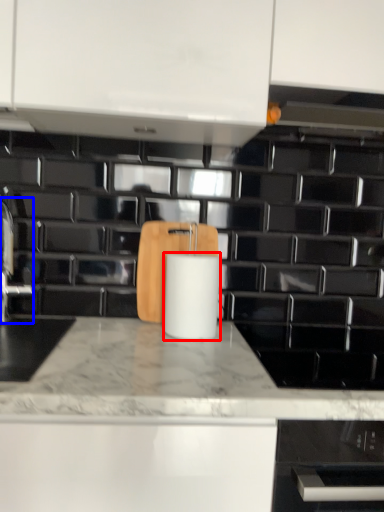
Question: Which point is closer to the camera, paper towel (highlighted by a red box) or faucet (highlighted by a blue box)?

Choices:
 (A) paper towel
 (B) faucet

Answer: (A)